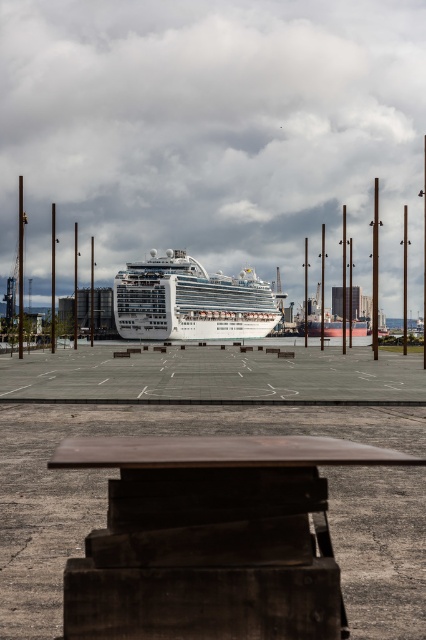
The width and height of the screenshot is (426, 640). What do you see at coordinates (210, 538) in the screenshot?
I see `dark brown wooden picnic table at center` at bounding box center [210, 538].

Is point (121, 550) behind point (183, 275)?

No.

You are a GUI agent. You are given a task and a screenshot of the screen. Output one action in this format:
    pyautogui.click(x=<x>, y=<y>)
    Task: Click on the dark brown wooden picnic table at center
    
    Given the screenshot: What is the action you would take?
    pyautogui.click(x=210, y=538)